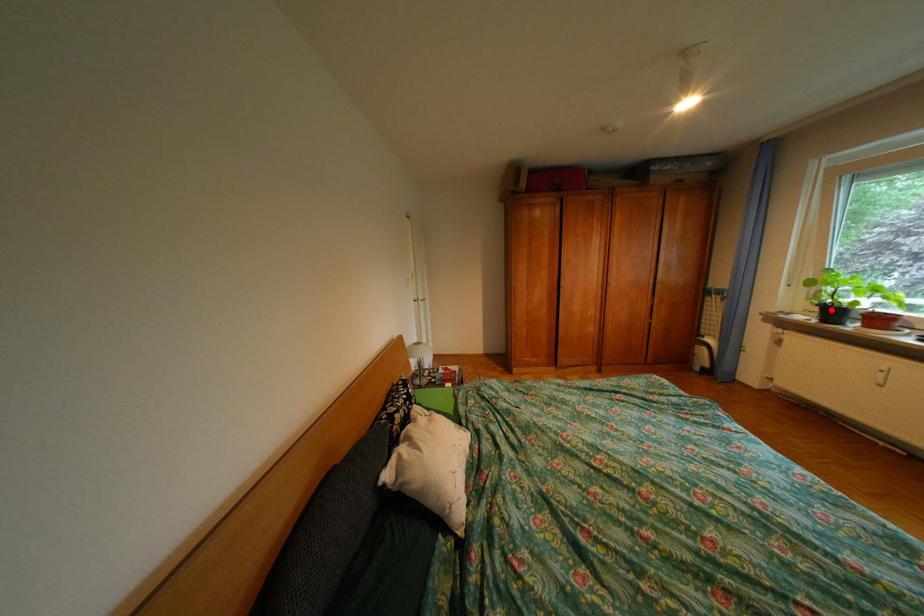
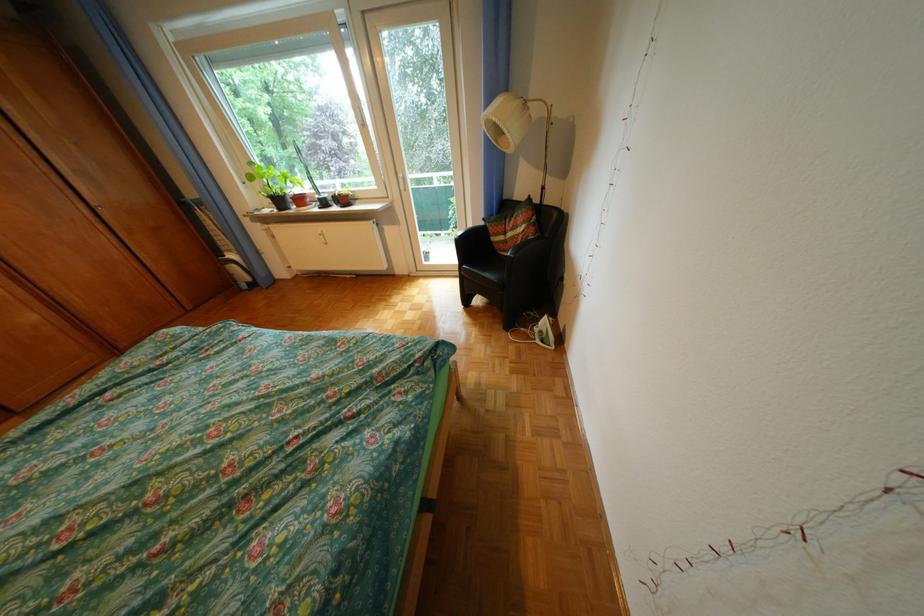
The point at the highlighted location is marked in the first image. Where is the corresponding point in the second image?

(284, 201)